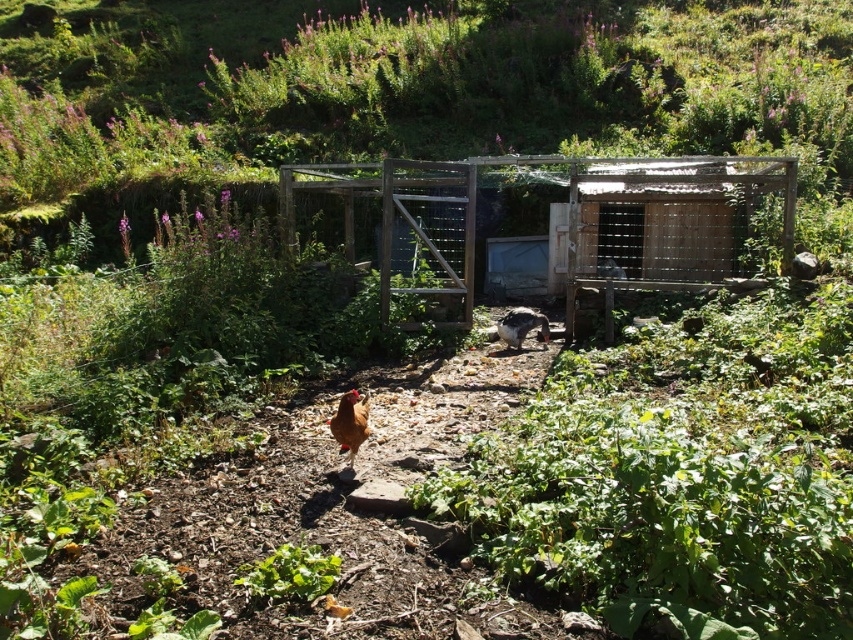
Which is below, wooden chicken coop at center or brown matte chicken at center?

Positioned lower is brown matte chicken at center.

I want to click on wooden chicken coop at center, so click(x=666, y=221).

In the scene shown: Is wooden chicken coop at center below white glossy chicken at center?

No, wooden chicken coop at center is not below white glossy chicken at center.

Can you confirm if wooden chicken coop at center is positioned to the right of white glossy chicken at center?

Indeed, wooden chicken coop at center is positioned on the right side of white glossy chicken at center.

Who is more forward, (601, 186) or (543, 340)?

Point (543, 340)

Find the location of a particular element. The width and height of the screenshot is (853, 640). wooden chicken coop at center is located at coordinates (666, 221).

Does brown matte chicken at center have a smaller size compared to white glossy chicken at center?

Indeed, brown matte chicken at center has a smaller size compared to white glossy chicken at center.

Which is more to the right, brown matte chicken at center or white glossy chicken at center?

white glossy chicken at center

This screenshot has width=853, height=640. What do you see at coordinates (350, 422) in the screenshot?
I see `brown matte chicken at center` at bounding box center [350, 422].

This screenshot has height=640, width=853. In order to click on brown matte chicken at center in this screenshot , I will do `click(350, 422)`.